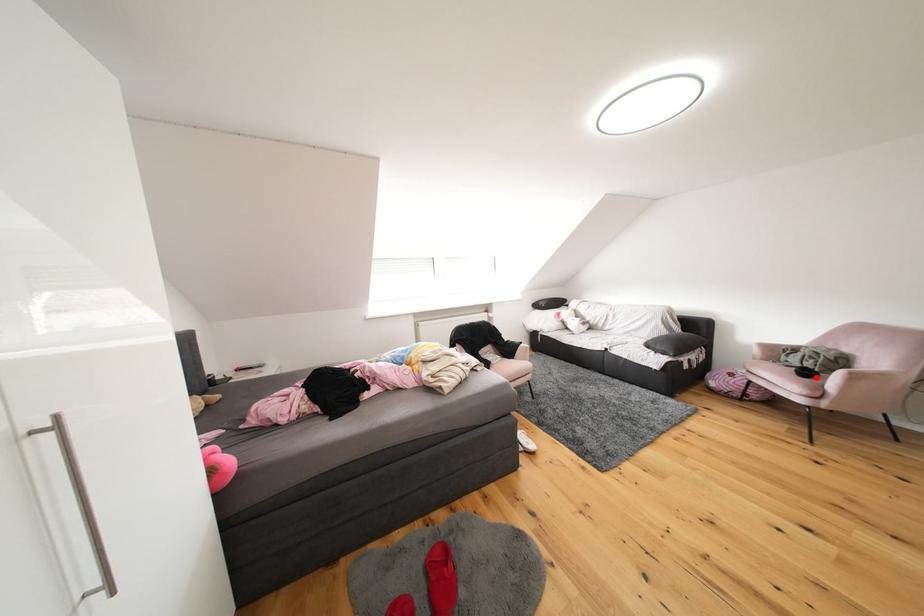
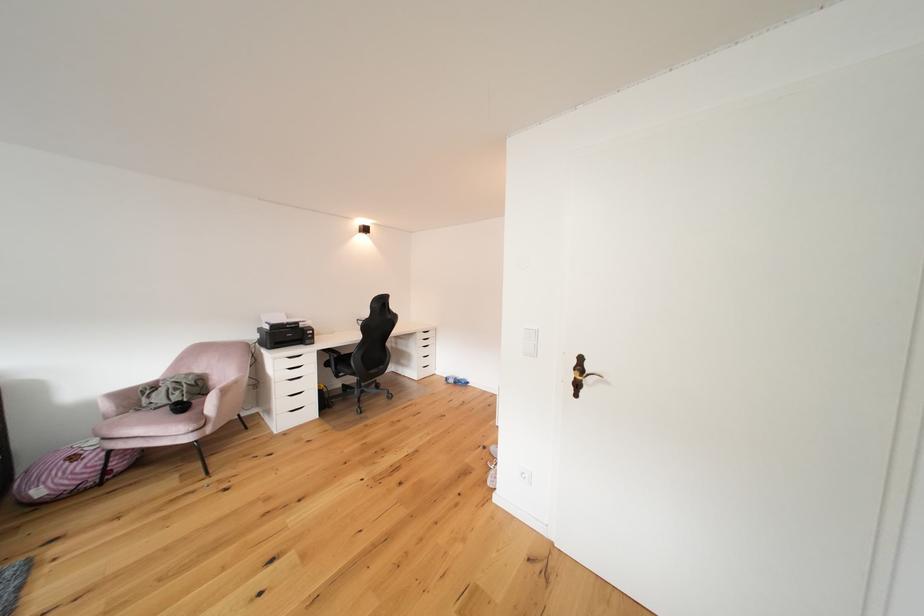
The point at the highlighted location is marked in the first image. Where is the corresponding point in the second image?

(190, 411)